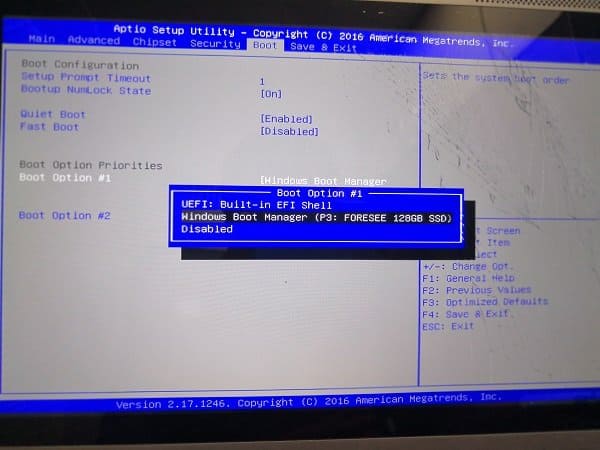
The image size is (600, 450). What are the coordinates of `top monitor border` in the screenshot? It's located at (345, 12).